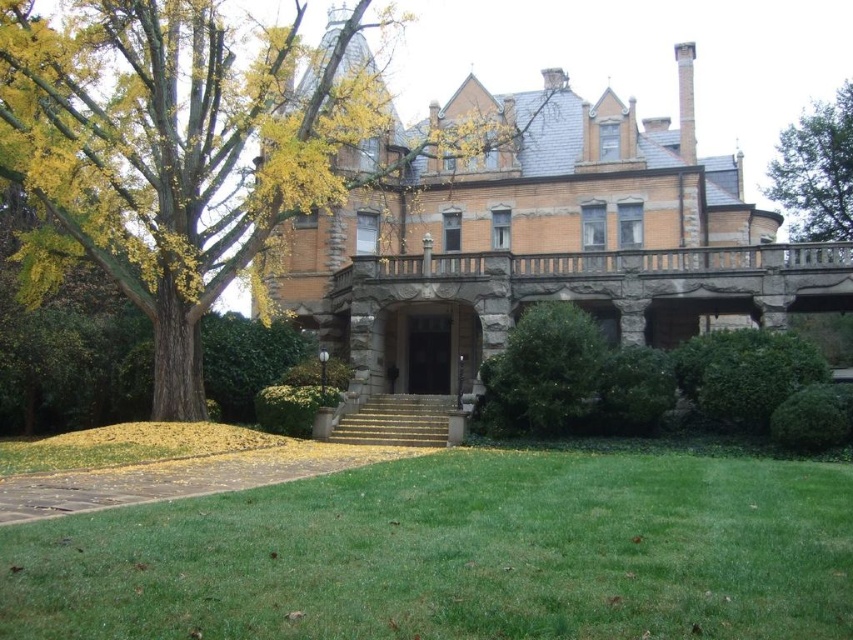
Question: Does brown stone mansion at center appear under yellow-green leaves at left?

Choices:
 (A) yes
 (B) no

Answer: (A)

Question: Which point appears farthest from the camera in this image?

Choices:
 (A) (817, 179)
 (B) (828, 465)

Answer: (A)

Question: Can you confirm if green grass at lower center is thinner than brown stone mansion at center?

Choices:
 (A) no
 (B) yes

Answer: (B)

Question: Which point appears farthest from the camera in this image?

Choices:
 (A) (20, 90)
 (B) (627, 232)

Answer: (B)

Question: Which is nearer to the green leafy tree at upper right?

Choices:
 (A) yellow-green leaves at left
 (B) brown stone mansion at center
 (C) green grass at lower center

Answer: (B)

Question: Does brown stone mansion at center lie behind yellow-green leaves at left?

Choices:
 (A) yes
 (B) no

Answer: (A)